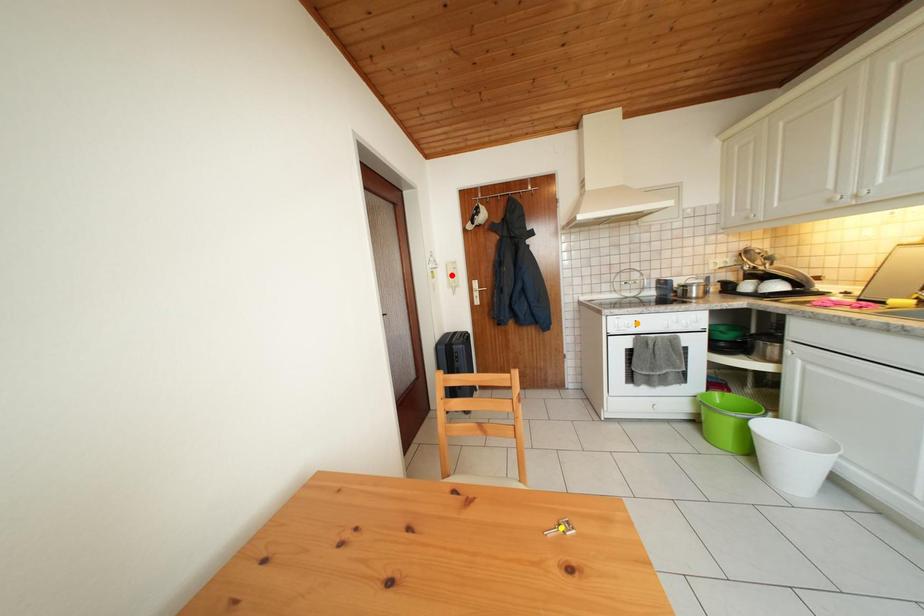
Order these from nearest to farthest:
orange point, red point, yellow point

yellow point < orange point < red point